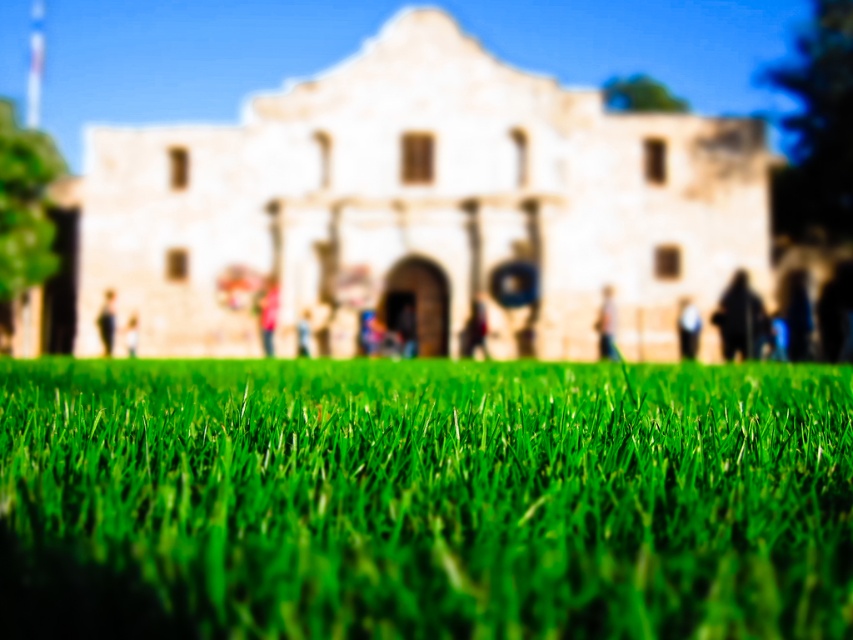
Looking at this image, you are standing in a grassy area and see a light brown leather jacket at center and a light brown wooden person at center. Which object is closer to you?

The light brown leather jacket at center is closer to you because it is in front of the light brown wooden person at center.

You are standing in a park and see the dark gray hoodie at center and the light brown wooden chair at center. Which object is closer to the ground?

The dark gray hoodie at center is closer to the ground because it is located below the light brown wooden chair at center.